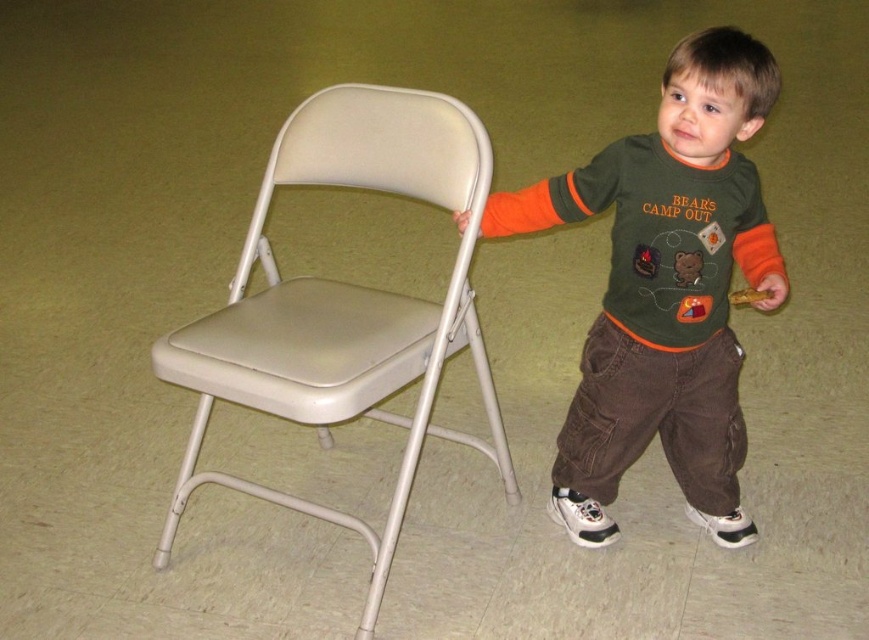
Does green cotton shirt at center have a larger size compared to beige plastic folding chair at left?

No.

Is green cotton shirt at center thinner than beige plastic folding chair at left?

Indeed, green cotton shirt at center has a lesser width compared to beige plastic folding chair at left.

Locate an element on the screen. This screenshot has width=869, height=640. green cotton shirt at center is located at coordinates (667, 289).

Find the location of a particular element. This screenshot has height=640, width=869. green cotton shirt at center is located at coordinates (667, 289).